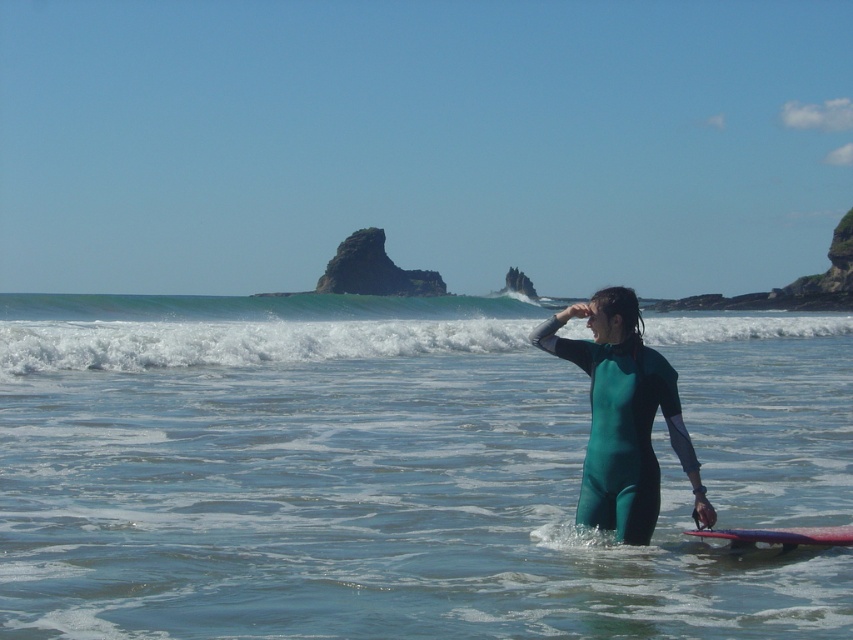
Question: Can you confirm if white foamy wave at upper center is thinner than green matte wetsuit at center?

Choices:
 (A) yes
 (B) no

Answer: (B)

Question: Which point is farther to the camera?

Choices:
 (A) smooth purple surfboard at center
 (B) green matte wetsuit at center
 (C) green rubber wetsuit at center
 (D) white foamy wave at upper center

Answer: (D)

Question: Which of the following is the closest to the observer?

Choices:
 (A) tap(850, 532)
 (B) tap(596, 522)

Answer: (A)

Question: From the image, what is the correct spatial relationship of green rubber wetsuit at center in relation to rough granite rock at center?

Choices:
 (A) below
 (B) above

Answer: (A)

Question: Which object is farther from the camera taking this photo?

Choices:
 (A) green matte wetsuit at center
 (B) green rubber wetsuit at center

Answer: (A)

Question: Does white foamy wave at upper center have a smaller size compared to rough granite rock at center?

Choices:
 (A) no
 (B) yes

Answer: (A)